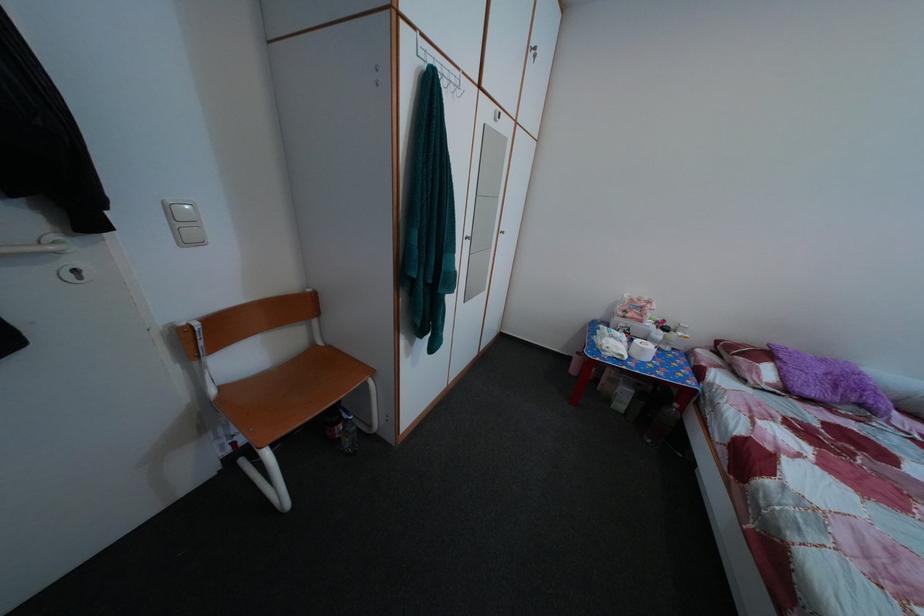
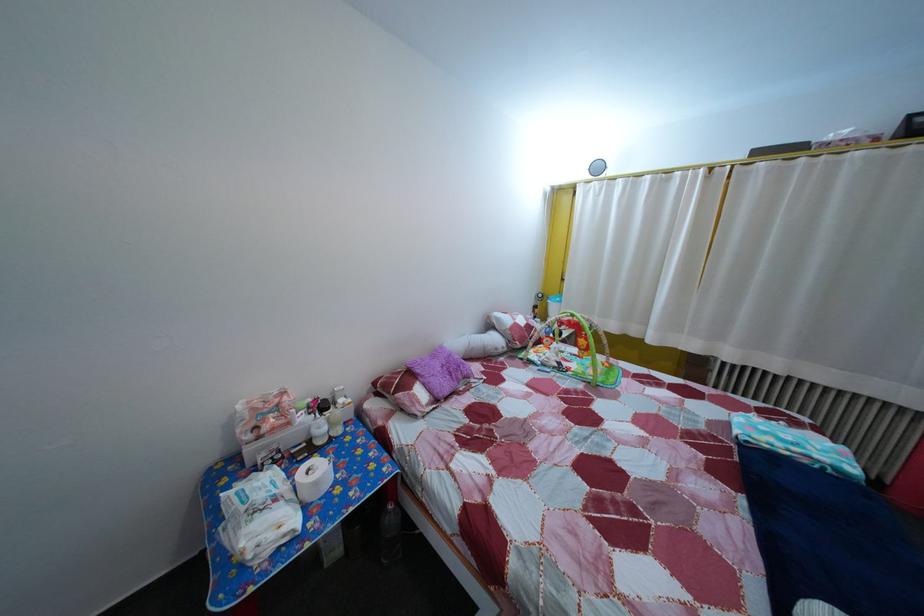
In the second image, find the point that corresponds to (x=789, y=378) in the first image.

(433, 392)